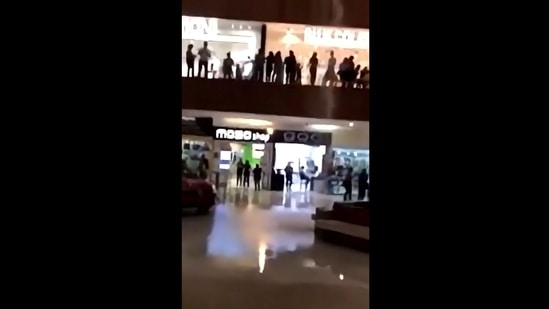
At what (x,y) coordinates should I click in order to perform the action: click on lights. Please return your answer as a coordinate pair (x, y). This screenshot has height=309, width=549. Looking at the image, I should click on (324, 127), (256, 124), (291, 36), (313, 120).